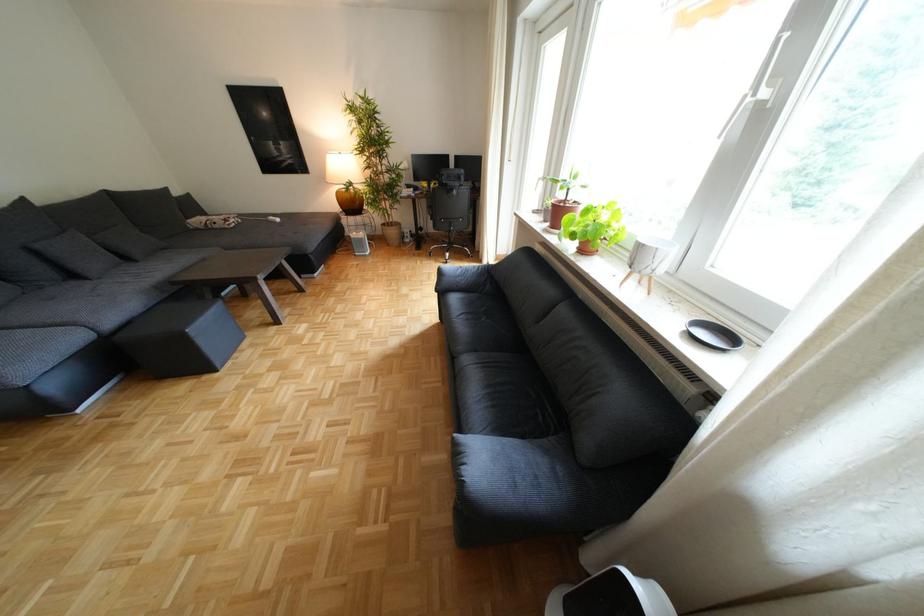
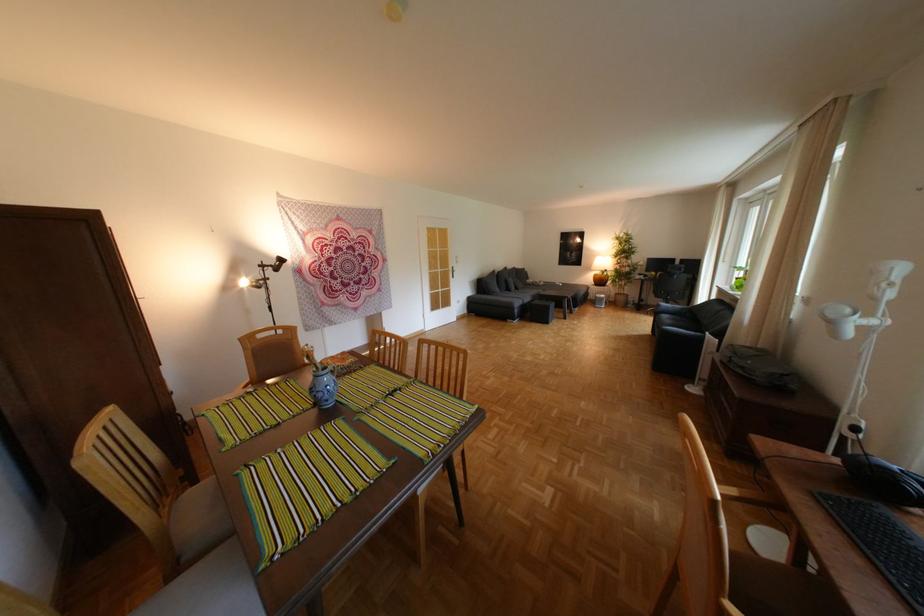
Find the pixel in the second image that matches point 368,140 in the first image.

(626, 252)